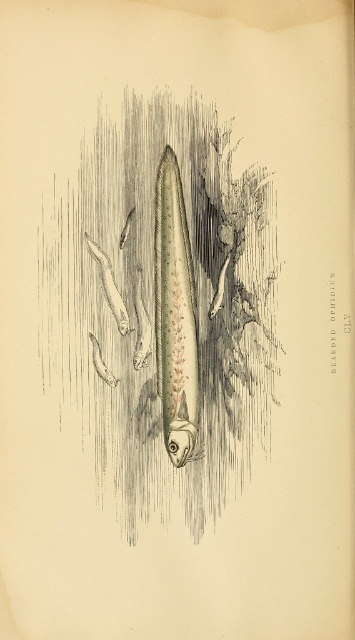
Based on the photo, can you confirm if grayish-green textured fish at center is positioned above shiny silver fish at center?

No.

What are the coordinates of `grayish-green textured fish at center` in the screenshot? It's located at (162, 307).